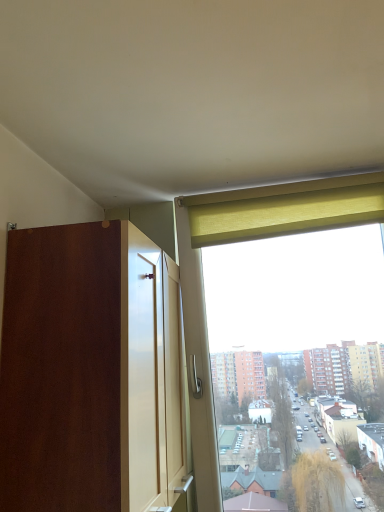
What are the coordinates of `matte wood dresser at left` in the screenshot? It's located at (92, 372).

Describe the element at coordinates (92, 372) in the screenshot. I see `matte wood dresser at left` at that location.

Where is `green fabric curtain at upper right`? green fabric curtain at upper right is located at coordinates (285, 214).

Describe the element at coordinates (285, 214) in the screenshot. The image size is (384, 512). I see `green fabric curtain at upper right` at that location.

At what (x,y) coordinates should I click in order to perform the action: click on matte wood dresser at left. Please return your answer as a coordinate pair (x, y). Looking at the image, I should click on (92, 372).

Which is more to the left, green fabric curtain at upper right or matte wood dresser at left?

matte wood dresser at left.

Is green fabric curtain at upper right further to camera compared to matte wood dresser at left?

Yes, it is.

Which is behind, point (266, 234) or point (111, 481)?

The point (266, 234) is farther from the camera.

From the image's perspective, is green fabric curtain at upper right under matte wood dresser at left?

No, from the image's perspective, green fabric curtain at upper right is not beneath matte wood dresser at left.

In the scene shown: From a real-world perspective, is green fabric curtain at upper right positioned above or below matte wood dresser at left?

green fabric curtain at upper right is situated higher than matte wood dresser at left in the real world.

In terms of width, does green fabric curtain at upper right look wider or thinner when compared to matte wood dresser at left?

green fabric curtain at upper right is thinner than matte wood dresser at left.

In the scene shown: Which of these two, green fabric curtain at upper right or matte wood dresser at left, stands taller?

matte wood dresser at left is taller.

Can you confirm if green fabric curtain at upper right is smaller than matte wood dresser at left?

Correct, green fabric curtain at upper right occupies less space than matte wood dresser at left.

Would you say green fabric curtain at upper right is outside matte wood dresser at left?

That's correct, green fabric curtain at upper right is outside of matte wood dresser at left.

Based on the photo, are green fabric curtain at upper right and matte wood dresser at left far apart?

Result: No, green fabric curtain at upper right is in close proximity to matte wood dresser at left.

Is matte wood dresser at left at the back of green fabric curtain at upper right?

No, matte wood dresser at left is not at the back of green fabric curtain at upper right.

How different are the orientations of green fabric curtain at upper right and matte wood dresser at left in degrees?

There is a 90.1-degree angle between the facing directions of green fabric curtain at upper right and matte wood dresser at left.

How distant is green fabric curtain at upper right from matte wood dresser at left?

They are 58.77 centimeters apart.

Locate an element on the screen. The height and width of the screenshot is (512, 384). curtain above the matte wood dresser at left (from the image's perspective) is located at coordinates (285, 214).

Which object is positioned more to the right, matte wood dresser at left or green fabric curtain at upper right?

green fabric curtain at upper right.

Is matte wood dresser at left in front of green fabric curtain at upper right?

Yes, matte wood dresser at left is closer to the viewer.

Considering the positions of points (61, 358) and (304, 216), is point (61, 358) farther from camera compared to point (304, 216)?

No, (61, 358) is closer to viewer.

From the image's perspective, is matte wood dresser at left above or below green fabric curtain at upper right?

From the image's perspective, matte wood dresser at left appears below green fabric curtain at upper right.

From a real-world perspective, which object stands above the other?

green fabric curtain at upper right is physically above.

Does matte wood dresser at left have a lesser width compared to green fabric curtain at upper right?

Incorrect, the width of matte wood dresser at left is not less than that of green fabric curtain at upper right.

Considering the sizes of objects matte wood dresser at left and green fabric curtain at upper right in the image provided, who is taller, matte wood dresser at left or green fabric curtain at upper right?

Standing taller between the two is matte wood dresser at left.

Looking at the image, does matte wood dresser at left seem bigger or smaller compared to green fabric curtain at upper right?

In the image, matte wood dresser at left appears to be larger than green fabric curtain at upper right.

Is matte wood dresser at left completely or partially outside of green fabric curtain at upper right?

matte wood dresser at left is positioned outside green fabric curtain at upper right.

Is matte wood dresser at left positioned far away from green fabric curtain at upper right?

No, matte wood dresser at left is in close proximity to green fabric curtain at upper right.

Does matte wood dresser at left turn towards green fabric curtain at upper right?

Yes, matte wood dresser at left is aimed at green fabric curtain at upper right.

Locate an element on the screen. curtain behind the matte wood dresser at left is located at coordinates (285, 214).

This screenshot has height=512, width=384. In the image, there is a green fabric curtain at upper right. In order to click on dresser below it (from the image's perspective) in this screenshot , I will do `click(92, 372)`.

At what (x,y) coordinates should I click in order to perform the action: click on curtain above the matte wood dresser at left (from the image's perspective). Please return your answer as a coordinate pair (x, y). Looking at the image, I should click on (285, 214).